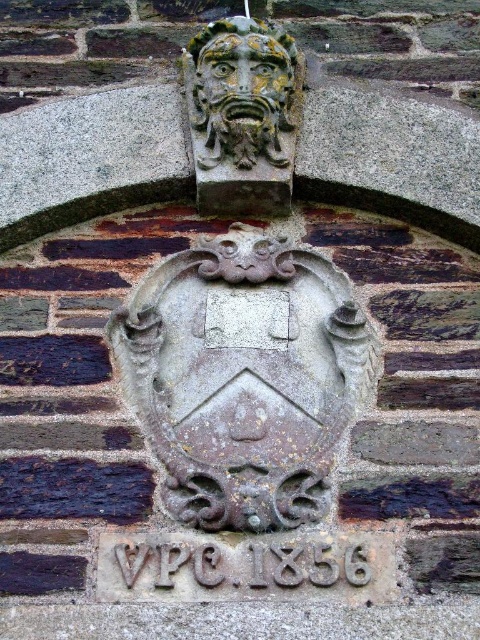
You are an architect examining the stone wall and need to determine the placement of a new decorative element. The new element must be placed below the carved stone face at upper center but above the gray stone shield at center. Is this possible given their current positions?

The gray stone shield at center has a greater height compared to the carved stone face at upper center. Therefore, placing a new decorative element between them would not be possible since the shield is taller than the face, likely overlapping or positioned in a way that leaves no vertical space between them.

You are an architect examining the stone wall and need to determine the spatial relationship between the gray stone shield at center and the carved stone face at upper center. Which object is positioned higher on the wall?

The carved stone face at upper center is positioned higher on the wall than the gray stone shield at center.